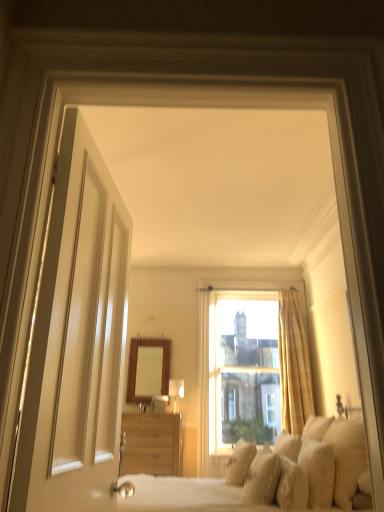
Question: From a real-world perspective, is white textured pillow at lower right, positioned as the fifth pillow in left-to-right order, over white glossy door at left?

Choices:
 (A) no
 (B) yes

Answer: (A)

Question: Does white textured pillow at lower right, positioned as the fifth pillow in left-to-right order, contain white glossy door at left?

Choices:
 (A) yes
 (B) no

Answer: (B)

Question: Is white textured pillow at lower right, the 2th pillow in the right-to-left sequence, outside of white glossy door at left?

Choices:
 (A) yes
 (B) no

Answer: (A)

Question: Does white textured pillow at lower right, the 2th pillow in the right-to-left sequence, have a smaller size compared to white glossy door at left?

Choices:
 (A) no
 (B) yes

Answer: (B)

Question: From a real-world perspective, is white textured pillow at lower right, the 2th pillow in the right-to-left sequence, beneath white glossy door at left?

Choices:
 (A) yes
 (B) no

Answer: (A)

Question: Is white glossy door at left in front of or behind clear glass window at center in the image?

Choices:
 (A) front
 (B) behind

Answer: (A)

Question: Looking at their shapes, would you say white glossy door at left is wider or thinner than clear glass window at center?

Choices:
 (A) wide
 (B) thin

Answer: (B)

Question: Does point (96, 303) appear closer or farther from the camera than point (215, 430)?

Choices:
 (A) closer
 (B) farther

Answer: (A)

Question: Is white glossy door at left taller or shorter than clear glass window at center?

Choices:
 (A) tall
 (B) short

Answer: (B)

Question: From a real-world perspective, is soft white pillow at lower right, the sixth pillow positioned from the left, physically located above or below white glossy door at left?

Choices:
 (A) below
 (B) above

Answer: (A)

Question: Is soft white pillow at lower right, the sixth pillow positioned from the left, situated inside white glossy door at left or outside?

Choices:
 (A) inside
 (B) outside

Answer: (B)

Question: In terms of width, does soft white pillow at lower right, which is counted as the first pillow, starting from the right, look wider or thinner when compared to white glossy door at left?

Choices:
 (A) thin
 (B) wide

Answer: (B)

Question: Visually, is soft white pillow at lower right, the sixth pillow positioned from the left, positioned to the left or to the right of white glossy door at left?

Choices:
 (A) left
 (B) right

Answer: (B)

Question: Is matte white lampshade at center inside the boundaries of white soft pillow at lower right, the 4th pillow viewed from the left, or outside?

Choices:
 (A) inside
 (B) outside

Answer: (B)

Question: Based on their sizes in the image, would you say matte white lampshade at center is bigger or smaller than white soft pillow at lower right, arranged as the 3th pillow when viewed from the right?

Choices:
 (A) small
 (B) big

Answer: (A)